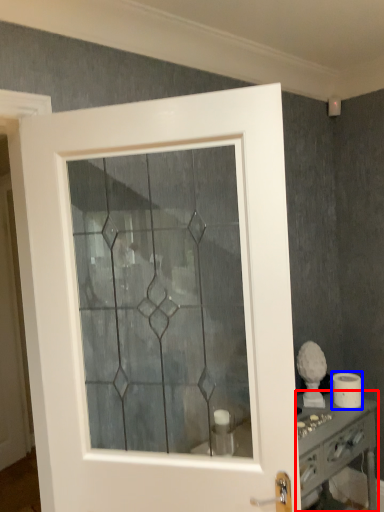
Question: Which object appears closest to the camera in this image, vanity (highlighted by a red box) or toilet paper (highlighted by a blue box)?

Choices:
 (A) vanity
 (B) toilet paper

Answer: (A)